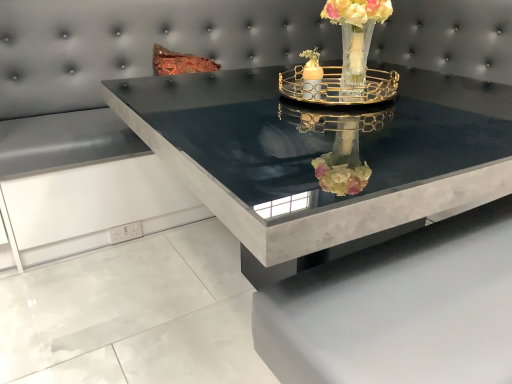
Where is `black marble table at center`? black marble table at center is located at coordinates (320, 152).

Where is `matte glass candle holder at center, the first candle holder from the left`? matte glass candle holder at center, the first candle holder from the left is located at coordinates (312, 74).

At what (x,y) coordinates should I click in order to perform the action: click on gold metallic tray at center, the second candle holder positioned from the left. Please return your answer as a coordinate pair (x, y). Looking at the image, I should click on click(338, 87).

Considering the relative sizes of translucent glass vase at upper center and matte glass candle holder at center, the second candle holder in the right-to-left sequence, in the image provided, is translucent glass vase at upper center wider than matte glass candle holder at center, the second candle holder in the right-to-left sequence,?

Yes.

From the picture: Which of these two, translucent glass vase at upper center or matte glass candle holder at center, the first candle holder from the left, stands taller?

translucent glass vase at upper center.

What's the angular difference between translucent glass vase at upper center and matte glass candle holder at center, the first candle holder from the left,'s facing directions?

There is a 0.000715-degree angle between the facing directions of translucent glass vase at upper center and matte glass candle holder at center, the first candle holder from the left.

Considering the sizes of objects translucent glass vase at upper center and matte glass candle holder at center, the second candle holder in the right-to-left sequence, in the image provided, who is smaller, translucent glass vase at upper center or matte glass candle holder at center, the second candle holder in the right-to-left sequence,?

Smaller between the two is matte glass candle holder at center, the second candle holder in the right-to-left sequence.

Is black marble table at center positioned with its back to matte glass candle holder at center, the first candle holder from the left?

black marble table at center is not turned away from matte glass candle holder at center, the first candle holder from the left.

From the image's perspective, which is below, black marble table at center or matte glass candle holder at center, the first candle holder from the left?

black marble table at center is shown below in the image.

Looking at this image, would you consider black marble table at center to be distant from matte glass candle holder at center, the first candle holder from the left?

No, black marble table at center is not far away from matte glass candle holder at center, the first candle holder from the left.

Considering the relative sizes of black marble table at center and matte glass candle holder at center, the second candle holder in the right-to-left sequence, in the image provided, is black marble table at center smaller than matte glass candle holder at center, the second candle holder in the right-to-left sequence,?

No, black marble table at center is not smaller than matte glass candle holder at center, the second candle holder in the right-to-left sequence.

Which point is more distant from viewer, (332,67) or (341,82)?

The point (332,67) is farther from the camera.

Considering the relative sizes of gold metallic tray at center, the second candle holder positioned from the left, and translucent glass vase at upper center in the image provided, is gold metallic tray at center, the second candle holder positioned from the left, smaller than translucent glass vase at upper center?

No, gold metallic tray at center, the second candle holder positioned from the left, is not smaller than translucent glass vase at upper center.

Between gold metallic tray at center, marked as the 1th candle holder in a right-to-left arrangement, and translucent glass vase at upper center, which one is positioned behind?

translucent glass vase at upper center.

Is matte glass candle holder at center, the second candle holder in the right-to-left sequence, in front of or behind translucent glass vase at upper center in the image?

matte glass candle holder at center, the second candle holder in the right-to-left sequence, is behind translucent glass vase at upper center.

Is matte glass candle holder at center, the first candle holder from the left, bigger than translucent glass vase at upper center?

No, matte glass candle holder at center, the first candle holder from the left, is not bigger than translucent glass vase at upper center.

How different are the orientations of matte glass candle holder at center, the first candle holder from the left, and translucent glass vase at upper center in degrees?

The angular difference between matte glass candle holder at center, the first candle holder from the left, and translucent glass vase at upper center is 0.000715 degrees.

From a real-world perspective, between matte glass candle holder at center, the first candle holder from the left, and translucent glass vase at upper center, who is vertically lower?

From a 3D spatial view, matte glass candle holder at center, the first candle holder from the left, is below.

Is translucent glass vase at upper center to the left or to the right of gold metallic tray at center, the second candle holder positioned from the left, in the image?

In the image, translucent glass vase at upper center appears on the right side of gold metallic tray at center, the second candle holder positioned from the left.

The height and width of the screenshot is (384, 512). I want to click on floral arrangement lying on the right of gold metallic tray at center, the second candle holder positioned from the left, so pyautogui.click(x=356, y=36).

Which point is more forward, (385, 0) or (325, 96)?

The point (385, 0) is closer to the camera.

Considering the relative sizes of translucent glass vase at upper center and gold metallic tray at center, marked as the 1th candle holder in a right-to-left arrangement, in the image provided, is translucent glass vase at upper center smaller than gold metallic tray at center, marked as the 1th candle holder in a right-to-left arrangement,?

Yes.

Would you say matte glass candle holder at center, the first candle holder from the left, contains gold metallic tray at center, marked as the 1th candle holder in a right-to-left arrangement?

No, gold metallic tray at center, marked as the 1th candle holder in a right-to-left arrangement, is located outside of matte glass candle holder at center, the first candle holder from the left.

From the picture: Is matte glass candle holder at center, the second candle holder in the right-to-left sequence, bigger than gold metallic tray at center, marked as the 1th candle holder in a right-to-left arrangement?

Actually, matte glass candle holder at center, the second candle holder in the right-to-left sequence, might be smaller than gold metallic tray at center, marked as the 1th candle holder in a right-to-left arrangement.

What's the angular difference between matte glass candle holder at center, the first candle holder from the left, and gold metallic tray at center, marked as the 1th candle holder in a right-to-left arrangement,'s facing directions?

The angle between the facing direction of matte glass candle holder at center, the first candle holder from the left, and the facing direction of gold metallic tray at center, marked as the 1th candle holder in a right-to-left arrangement, is 3.87 degrees.

Is matte glass candle holder at center, the first candle holder from the left, aimed at gold metallic tray at center, marked as the 1th candle holder in a right-to-left arrangement?

Yes, matte glass candle holder at center, the first candle holder from the left, is facing gold metallic tray at center, marked as the 1th candle holder in a right-to-left arrangement.

Which point is more distant from viewer, (415, 215) or (300, 85)?

The point (300, 85) is behind.

Is black marble table at center inside or outside of gold metallic tray at center, marked as the 1th candle holder in a right-to-left arrangement?

The correct answer is: outside.

Between black marble table at center and gold metallic tray at center, the second candle holder positioned from the left, which one has smaller size?

With smaller size is gold metallic tray at center, the second candle holder positioned from the left.

Considering their positions, is black marble table at center located in front of or behind gold metallic tray at center, marked as the 1th candle holder in a right-to-left arrangement?

Clearly, black marble table at center is in front of gold metallic tray at center, marked as the 1th candle holder in a right-to-left arrangement.

What are the coordinates of `candle holder that is the 2nd object to the left of the translucent glass vase at upper center, starting at the anchor` in the screenshot? It's located at [x=312, y=74].

The height and width of the screenshot is (384, 512). Identify the location of the 2nd candle holder positioned above the black marble table at center (from a real-world perspective). (312, 74).

Looking at this image, looking at the image, which one is located further to gold metallic tray at center, the second candle holder positioned from the left, matte glass candle holder at center, the second candle holder in the right-to-left sequence, or black marble table at center?

Among the two, black marble table at center is located further to gold metallic tray at center, the second candle holder positioned from the left.

Looking at the image, which one is located further to black marble table at center, gold metallic tray at center, the second candle holder positioned from the left, or translucent glass vase at upper center?

The object further to black marble table at center is translucent glass vase at upper center.

From the image, which object appears to be nearer to matte glass candle holder at center, the second candle holder in the right-to-left sequence, black marble table at center or translucent glass vase at upper center?

The object closer to matte glass candle holder at center, the second candle holder in the right-to-left sequence, is translucent glass vase at upper center.

Estimate the real-world distances between objects in this image. Which object is further from gold metallic tray at center, marked as the 1th candle holder in a right-to-left arrangement, black marble table at center or matte glass candle holder at center, the second candle holder in the right-to-left sequence?

Among the two, black marble table at center is located further to gold metallic tray at center, marked as the 1th candle holder in a right-to-left arrangement.

Which object lies nearer to the anchor point black marble table at center, matte glass candle holder at center, the second candle holder in the right-to-left sequence, or gold metallic tray at center, the second candle holder positioned from the left?

gold metallic tray at center, the second candle holder positioned from the left, is positioned closer to the anchor black marble table at center.

Based on their spatial positions, is gold metallic tray at center, the second candle holder positioned from the left, or matte glass candle holder at center, the first candle holder from the left, closer to translucent glass vase at upper center?

Among the two, gold metallic tray at center, the second candle holder positioned from the left, is located nearer to translucent glass vase at upper center.

From the image, which object appears to be nearer to matte glass candle holder at center, the second candle holder in the right-to-left sequence, gold metallic tray at center, marked as the 1th candle holder in a right-to-left arrangement, or translucent glass vase at upper center?

Based on the image, gold metallic tray at center, marked as the 1th candle holder in a right-to-left arrangement, appears to be nearer to matte glass candle holder at center, the second candle holder in the right-to-left sequence.

Looking at this image, when comparing their distances from black marble table at center, does translucent glass vase at upper center or matte glass candle holder at center, the second candle holder in the right-to-left sequence, seem further?

Based on the image, matte glass candle holder at center, the second candle holder in the right-to-left sequence, appears to be further to black marble table at center.

Where is `candle holder positioned between black marble table at center and matte glass candle holder at center, the first candle holder from the left, from near to far`? The height and width of the screenshot is (384, 512). candle holder positioned between black marble table at center and matte glass candle holder at center, the first candle holder from the left, from near to far is located at coordinates (338, 87).

The height and width of the screenshot is (384, 512). Identify the location of floral arrangement between gold metallic tray at center, the second candle holder positioned from the left, and matte glass candle holder at center, the first candle holder from the left, along the z-axis. (356, 36).

Find the location of a particular element. floral arrangement between black marble table at center and matte glass candle holder at center, the second candle holder in the right-to-left sequence, in the front-back direction is located at coordinates (356, 36).

In order to click on candle holder between black marble table at center and translucent glass vase at upper center from front to back in this screenshot , I will do `click(338, 87)`.